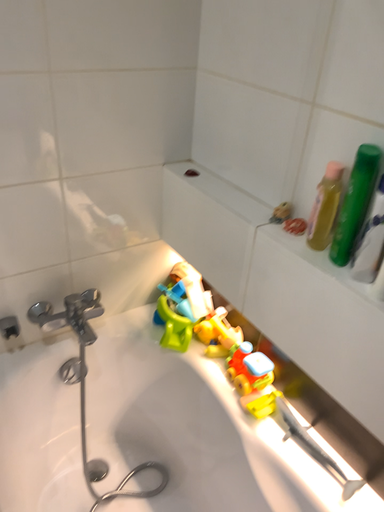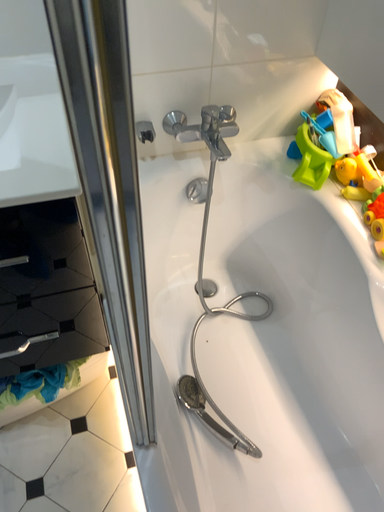
Question: How did the camera likely rotate when shooting the video?

Choices:
 (A) rotated left
 (B) rotated right

Answer: (A)